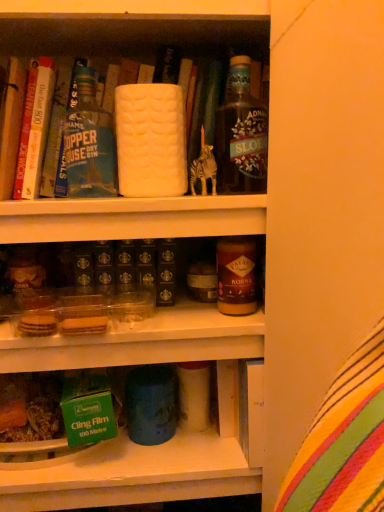
In order to face brown glass jar at center, should I rotate leftwards or rightwards?

To align with it, rotate right about 6.661°.

Image resolution: width=384 pixels, height=512 pixels. Describe the element at coordinates (236, 275) in the screenshot. I see `brown glass jar at center` at that location.

What are the coordinates of `white matte bottle at upper center, which is counted as the first bottle, starting from the left` in the screenshot? It's located at (89, 143).

This screenshot has width=384, height=512. What are the coordinates of `hardcover book at upper left, which ranks as the second book in front-to-back order` in the screenshot? It's located at (34, 128).

This screenshot has height=512, width=384. I want to click on hardcover book at upper left, which ranks as the 2th book in back-to-front order, so click(11, 125).

Based on the photo, what is the approximate height of green matte cling film at lower left?

green matte cling film at lower left is 3.23 inches tall.

Identify the location of translucent glass bottle at upper right, the 1th bottle from the right. (241, 135).

Does translucent glass bottle at upper right, the 1th bottle from the right, have a smaller size compared to green matte cling film at lower left?

Yes, translucent glass bottle at upper right, the 1th bottle from the right, is smaller than green matte cling film at lower left.

From the image's perspective, between translucent glass bottle at upper right, positioned as the 2th bottle in left-to-right order, and green matte cling film at lower left, which one is located above?

translucent glass bottle at upper right, positioned as the 2th bottle in left-to-right order, from the image's perspective.

Could you measure the distance between translucent glass bottle at upper right, positioned as the 2th bottle in left-to-right order, and green matte cling film at lower left?

The distance of translucent glass bottle at upper right, positioned as the 2th bottle in left-to-right order, from green matte cling film at lower left is 18.35 inches.

Is translucent glass bottle at upper right, the 1th bottle from the right, shorter than green matte cling film at lower left?

No.

Based on the photo, which of these two, green matte cling film at lower left or brown glass jar at center, is smaller?

Smaller between the two is brown glass jar at center.

Is green matte cling film at lower left located outside brown glass jar at center?

Yes, green matte cling film at lower left is outside of brown glass jar at center.

Between green matte cling film at lower left and brown glass jar at center, which one appears on the right side from the viewer's perspective?

Positioned to the right is brown glass jar at center.

Considering the sizes of objects green matte cling film at lower left and white matte bottle at upper center, positioned as the second bottle in right-to-left order, in the image provided, who is taller, green matte cling film at lower left or white matte bottle at upper center, positioned as the second bottle in right-to-left order,?

white matte bottle at upper center, positioned as the second bottle in right-to-left order.

In the image, is green matte cling film at lower left positioned in front of or behind white matte bottle at upper center, positioned as the second bottle in right-to-left order?

In the image, green matte cling film at lower left appears behind white matte bottle at upper center, positioned as the second bottle in right-to-left order.

Can you confirm if green matte cling film at lower left is wider than white matte bottle at upper center, which is counted as the first bottle, starting from the left?

Indeed, green matte cling film at lower left has a greater width compared to white matte bottle at upper center, which is counted as the first bottle, starting from the left.

In the scene shown: From a real-world perspective, is green matte cling film at lower left above or below white matte bottle at upper center, which is counted as the first bottle, starting from the left?

green matte cling film at lower left is situated lower than white matte bottle at upper center, which is counted as the first bottle, starting from the left, in the real world.

How many degrees apart are the facing directions of hardcover book at upper left, which ranks as the 2th book in back-to-front order, and hardcover book at upper left, which ranks as the second book in front-to-back order?

The angle between the facing direction of hardcover book at upper left, which ranks as the 2th book in back-to-front order, and the facing direction of hardcover book at upper left, which ranks as the second book in front-to-back order, is 6.41 degrees.

Can you confirm if hardcover book at upper left, the 1th book positioned from the front, is thinner than hardcover book at upper left, which ranks as the second book in front-to-back order?

Yes, hardcover book at upper left, the 1th book positioned from the front, is thinner than hardcover book at upper left, which ranks as the second book in front-to-back order.

Is hardcover book at upper left, the 1th book positioned from the front, turned away from hardcover book at upper left, which is counted as the 1th book, starting from the back?

hardcover book at upper left, the 1th book positioned from the front, is not turned away from hardcover book at upper left, which is counted as the 1th book, starting from the back.

Does brown glass jar at center have a greater width compared to hardcover book at upper left, the 1th book positioned from the front?

In fact, brown glass jar at center might be narrower than hardcover book at upper left, the 1th book positioned from the front.

Is brown glass jar at center situated inside hardcover book at upper left, which ranks as the 2th book in back-to-front order, or outside?

brown glass jar at center is outside hardcover book at upper left, which ranks as the 2th book in back-to-front order.

From the image's perspective, is brown glass jar at center above or below hardcover book at upper left, the 1th book positioned from the front?

brown glass jar at center is situated lower than hardcover book at upper left, the 1th book positioned from the front, in the image.

Which is in front, hardcover book at upper left, which is counted as the 1th book, starting from the back, or green matte cling film at lower left?

green matte cling film at lower left is closer to the camera.

Looking at this image, between hardcover book at upper left, which ranks as the second book in front-to-back order, and green matte cling film at lower left, which one appears on the right side from the viewer's perspective?

green matte cling film at lower left is more to the right.

Considering the sizes of objects hardcover book at upper left, which ranks as the second book in front-to-back order, and green matte cling film at lower left in the image provided, who is thinner, hardcover book at upper left, which ranks as the second book in front-to-back order, or green matte cling film at lower left?

Thinner between the two is hardcover book at upper left, which ranks as the second book in front-to-back order.

Is point (29, 83) closer or farther from the camera than point (68, 465)?

Clearly, point (29, 83) is closer to the camera than point (68, 465).

Which is nearer, (x=40, y=106) or (x=237, y=123)?

Point (x=40, y=106) is positioned farther from the camera compared to point (x=237, y=123).

Is hardcover book at upper left, which is counted as the 1th book, starting from the back, in contact with translucent glass bottle at upper right, the 1th bottle from the right?

There is a gap between hardcover book at upper left, which is counted as the 1th book, starting from the back, and translucent glass bottle at upper right, the 1th bottle from the right.

Is hardcover book at upper left, which ranks as the second book in front-to-back order, to the left or to the right of translucent glass bottle at upper right, positioned as the 2th bottle in left-to-right order, in the image?

Clearly, hardcover book at upper left, which ranks as the second book in front-to-back order, is on the left of translucent glass bottle at upper right, positioned as the 2th bottle in left-to-right order, in the image.

Is hardcover book at upper left, which ranks as the second book in front-to-back order, oriented towards translucent glass bottle at upper right, the 1th bottle from the right?

No.

You are a GUI agent. You are given a task and a screenshot of the screen. Output one action in this format:
    pyautogui.click(x=<x>, y=<y>)
    Task: Click on the bottle on the right of green matte cling film at lower left
    Image resolution: width=384 pixels, height=512 pixels.
    Given the screenshot: What is the action you would take?
    (x=241, y=135)

This screenshot has height=512, width=384. Find the location of `shelf that is in front of the brown glass jar at center`. shelf that is in front of the brown glass jar at center is located at coordinates (148, 454).

When comparing their distances from hardcover book at upper left, which ranks as the second book in front-to-back order, does green matte cling film at lower left or translucent glass bottle at upper right, the 1th bottle from the right, seem closer?

translucent glass bottle at upper right, the 1th bottle from the right, lies closer to hardcover book at upper left, which ranks as the second book in front-to-back order, than the other object.

Estimate the real-world distances between objects in this image. Which object is closer to brown glass jar at center, hardcover book at upper left, which ranks as the 2th book in back-to-front order, or hardcover book at upper left, which is counted as the 1th book, starting from the back?

hardcover book at upper left, which is counted as the 1th book, starting from the back, is closer to brown glass jar at center.

When comparing their distances from translucent glass bottle at upper right, positioned as the 2th bottle in left-to-right order, does hardcover book at upper left, which is counted as the 1th book, starting from the back, or green matte cling film at lower left seem closer?

Based on the image, hardcover book at upper left, which is counted as the 1th book, starting from the back, appears to be nearer to translucent glass bottle at upper right, positioned as the 2th bottle in left-to-right order.

Estimate the real-world distances between objects in this image. Which object is further from translucent glass bottle at upper right, the 1th bottle from the right, hardcover book at upper left, which ranks as the 2th book in back-to-front order, or hardcover book at upper left, which ranks as the second book in front-to-back order?

hardcover book at upper left, which ranks as the 2th book in back-to-front order, is further to translucent glass bottle at upper right, the 1th bottle from the right.

Looking at the image, which one is located further to translucent glass bottle at upper right, positioned as the 2th bottle in left-to-right order, green matte cling film at lower left or white matte bottle at upper center, which is counted as the first bottle, starting from the left?

green matte cling film at lower left lies further to translucent glass bottle at upper right, positioned as the 2th bottle in left-to-right order, than the other object.

Estimate the real-world distances between objects in this image. Which object is further from white matte bottle at upper center, which is counted as the first bottle, starting from the left, hardcover book at upper left, which ranks as the second book in front-to-back order, or brown glass jar at center?

Result: brown glass jar at center is further to white matte bottle at upper center, which is counted as the first bottle, starting from the left.

Based on their spatial positions, is white matte bottle at upper center, which is counted as the first bottle, starting from the left, or hardcover book at upper left, which is counted as the 1th book, starting from the back, closer to translucent glass bottle at upper right, positioned as the 2th bottle in left-to-right order?

white matte bottle at upper center, which is counted as the first bottle, starting from the left, is positioned closer to the anchor translucent glass bottle at upper right, positioned as the 2th bottle in left-to-right order.

Based on their spatial positions, is green matte cling film at lower left or hardcover book at upper left, which is counted as the 1th book, starting from the back, closer to brown glass jar at center?

Based on the image, green matte cling film at lower left appears to be nearer to brown glass jar at center.

Locate an element on the screen. book located between hardcover book at upper left, the 1th book positioned from the front, and brown glass jar at center in the left-right direction is located at coordinates click(x=34, y=128).

Locate an element on the screen. bottle between hardcover book at upper left, which ranks as the second book in front-to-back order, and translucent glass bottle at upper right, positioned as the 2th bottle in left-to-right order, from left to right is located at coordinates (89, 143).

Where is `bottle situated between hardcover book at upper left, which is counted as the 1th book, starting from the back, and brown glass jar at center from left to right`? The width and height of the screenshot is (384, 512). bottle situated between hardcover book at upper left, which is counted as the 1th book, starting from the back, and brown glass jar at center from left to right is located at coordinates (89, 143).

Identify the location of book between translucent glass bottle at upper right, the 1th bottle from the right, and green matte cling film at lower left from top to bottom. 11,125.